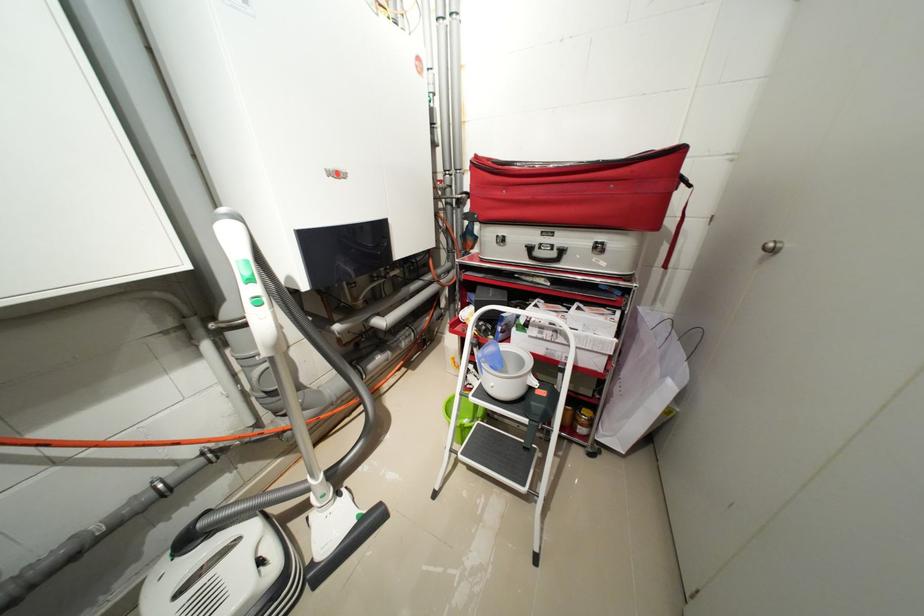
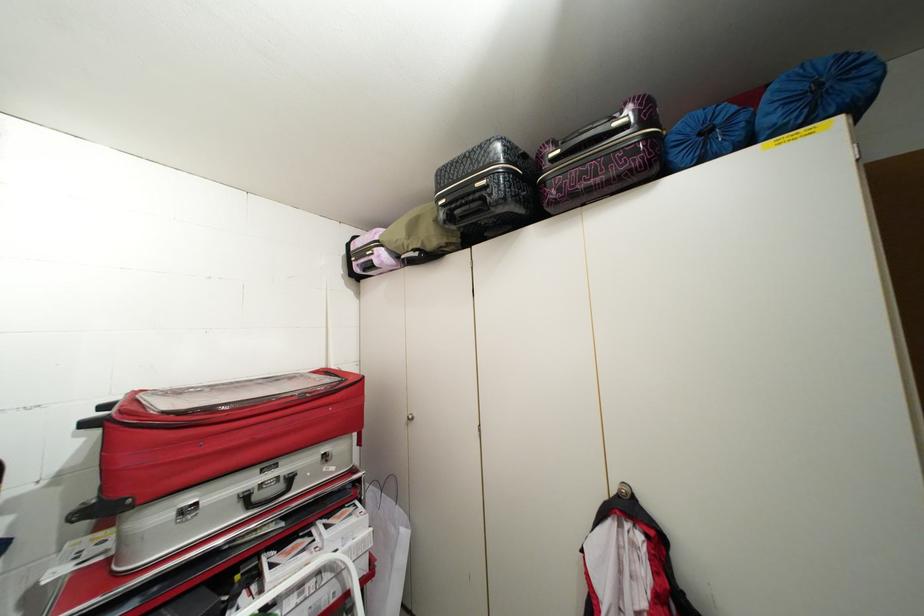
Where in the second image is the point corresponding to point 561,254 from the first image?

(287, 487)